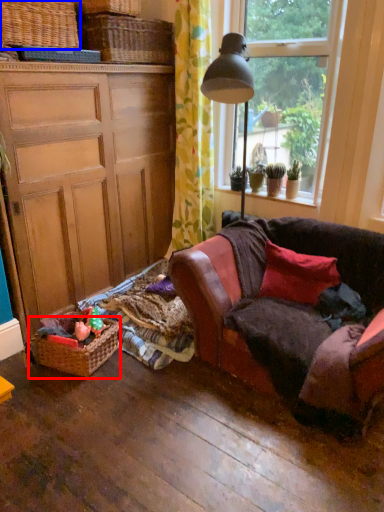
Question: Which object appears closest to the camera in this image, picnic basket (highlighted by a red box) or picnic basket (highlighted by a blue box)?

Choices:
 (A) picnic basket
 (B) picnic basket

Answer: (B)